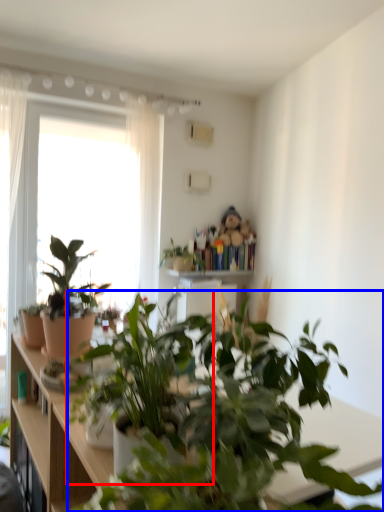
Question: Which object appears farthest to the camera in this image, houseplant (highlighted by a red box) or houseplant (highlighted by a blue box)?

Choices:
 (A) houseplant
 (B) houseplant

Answer: (B)